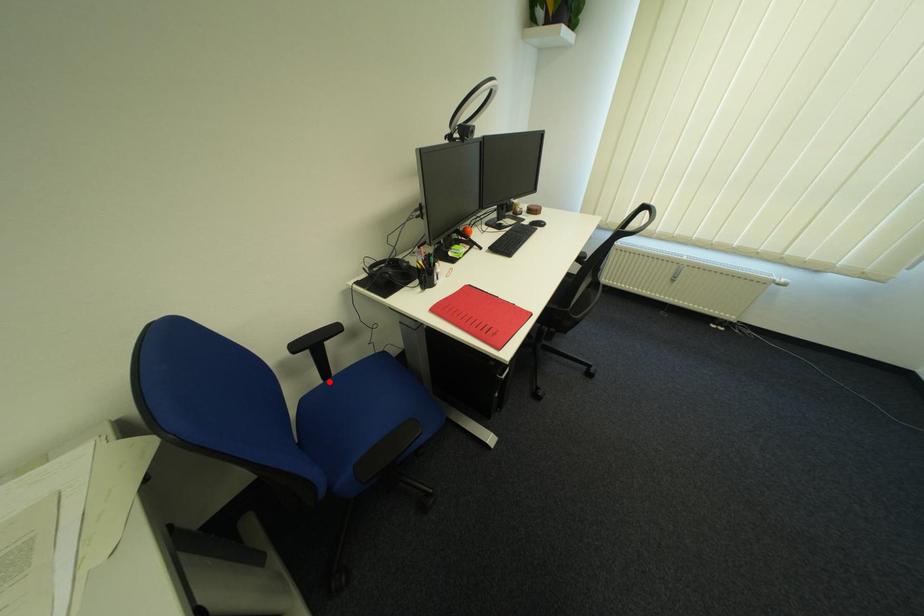
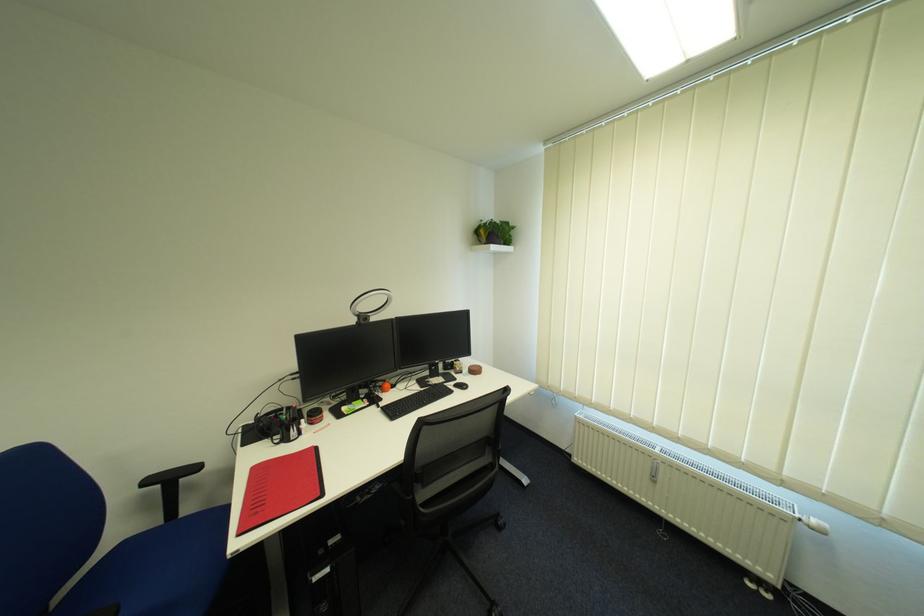
Locate, in the second image, the point that corresponds to the highlighted location in the first image.

(171, 524)